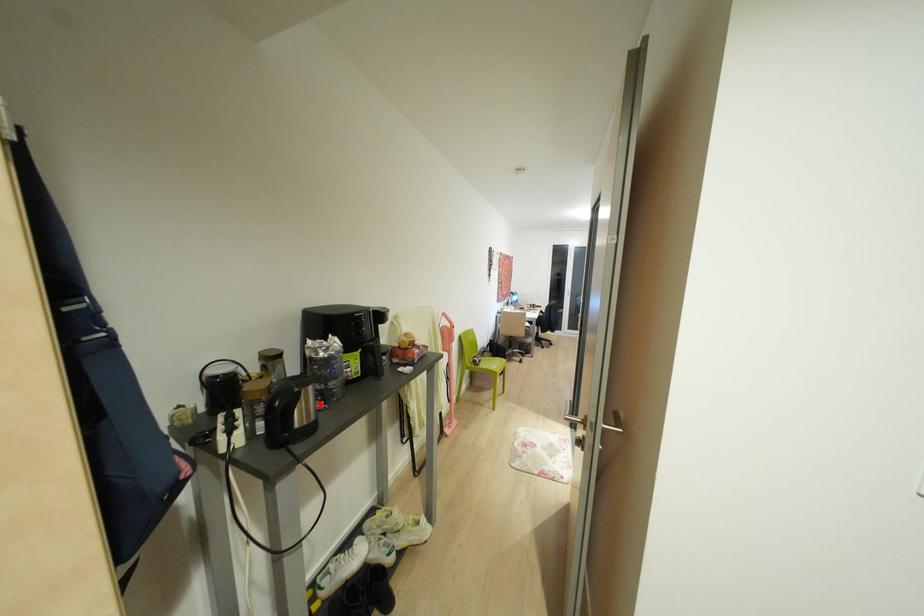
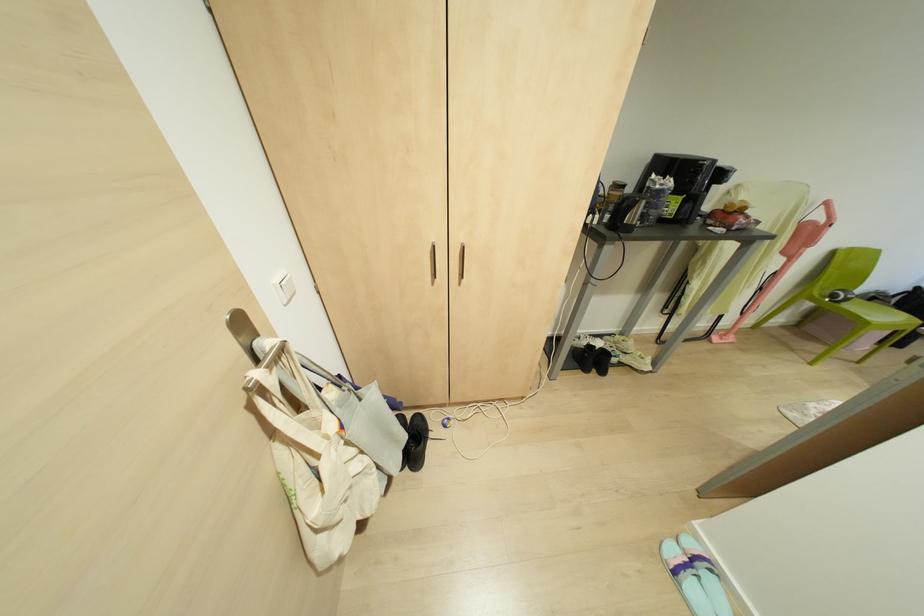
Where in the second image is the point corresponding to the highlighted location from the first image?

(637, 223)